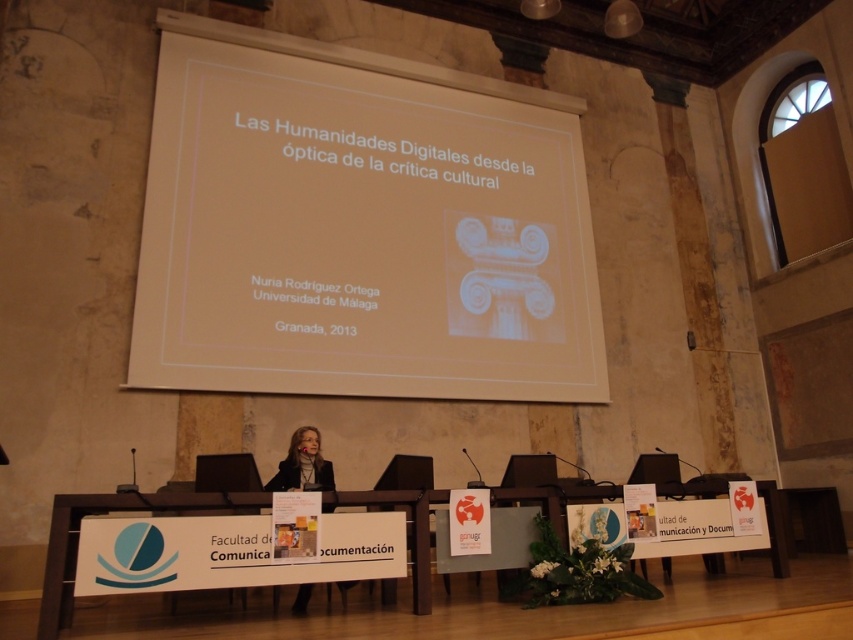
Is white wood table at center to the left of matte black suit at center from the viewer's perspective?

Indeed, white wood table at center is positioned on the left side of matte black suit at center.

This screenshot has height=640, width=853. In order to click on white wood table at center in this screenshot , I will do `click(103, 513)`.

Where is `white wood table at center`? The height and width of the screenshot is (640, 853). white wood table at center is located at coordinates (103, 513).

Is white paper at upper center thinner than white wood table at center?

Yes, white paper at upper center is thinner than white wood table at center.

Is white paper at upper center closer to the viewer compared to white wood table at center?

No, it is not.

Is point (300, 385) less distant than point (430, 605)?

No.

In order to click on white paper at upper center in this screenshot , I will do `click(360, 227)`.

Can you confirm if white paper at upper center is smaller than matte black suit at center?

Yes, white paper at upper center is smaller than matte black suit at center.

Is white paper at upper center below matte black suit at center?

No, white paper at upper center is not below matte black suit at center.

Who is more distant from viewer, (480,234) or (312,426)?

The point (480,234) is behind.

Image resolution: width=853 pixels, height=640 pixels. I want to click on white paper at upper center, so click(x=360, y=227).